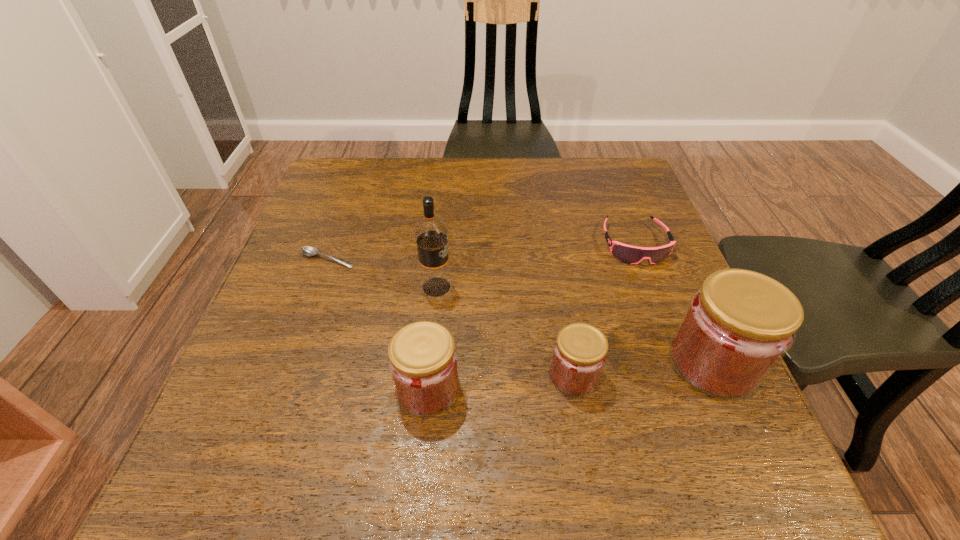
Where is `free location that satisfies the following two spatial constraints: 1. on the label of the vodka; 2. on the back side of the tallest jam`? The image size is (960, 540). free location that satisfies the following two spatial constraints: 1. on the label of the vodka; 2. on the back side of the tallest jam is located at coordinates (429, 362).

At what (x,y) coordinates should I click in order to perform the action: click on free space that satisfies the following two spatial constraints: 1. on the front-facing side of the goggles; 2. on the label of the tallest object. Please return your answer as a coordinate pair (x, y). Looking at the image, I should click on (651, 287).

This screenshot has height=540, width=960. In order to click on free location that satisfies the following two spatial constraints: 1. on the label of the tallest object; 2. on the left side of the second shortest jam in this screenshot , I will do `click(426, 388)`.

You are a GUI agent. You are given a task and a screenshot of the screen. Output one action in this format:
    pyautogui.click(x=<x>, y=<y>)
    Task: Click on the free spot that satisfies the following two spatial constraints: 1. on the front-facing side of the goggles; 2. on the left side of the rightmost jam
    
    Given the screenshot: What is the action you would take?
    pyautogui.click(x=680, y=362)

In order to click on vacant position in the image that satisfies the following two spatial constraints: 1. on the front-facing side of the rightmost jam; 2. on the right side of the goggles in this screenshot , I will do `click(680, 362)`.